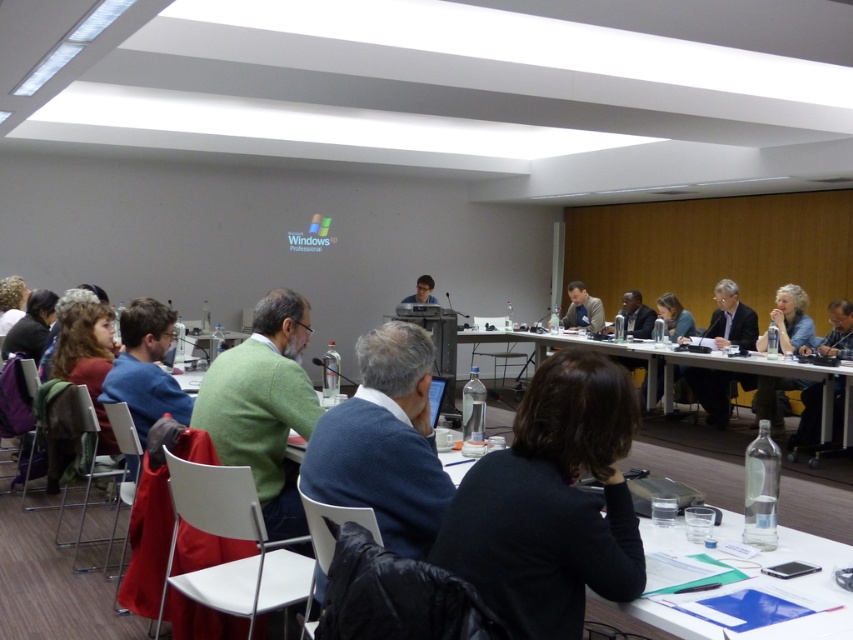
Question: Which object is the closest to the dark suit at right?

Choices:
 (A) black fabric jacket at center
 (B) light brown leather jacket at center

Answer: (B)

Question: Which is farther from the matte black laptop at center?

Choices:
 (A) blue sweater at center
 (B) dark suit at right
 (C) green sweater at center

Answer: (A)

Question: Can you confirm if blue denim shirt at lower right is thinner than matte gray jacket at center?

Choices:
 (A) no
 (B) yes

Answer: (A)

Question: Is blue sweater at center positioned behind blue denim shirt at lower right?

Choices:
 (A) yes
 (B) no

Answer: (B)

Question: Is the position of dark suit at right less distant than that of light brown leather jacket at center?

Choices:
 (A) yes
 (B) no

Answer: (A)

Question: Which point is closer to the camera?

Choices:
 (A) (596, 308)
 (B) (801, 298)
 (C) (519, 454)

Answer: (C)